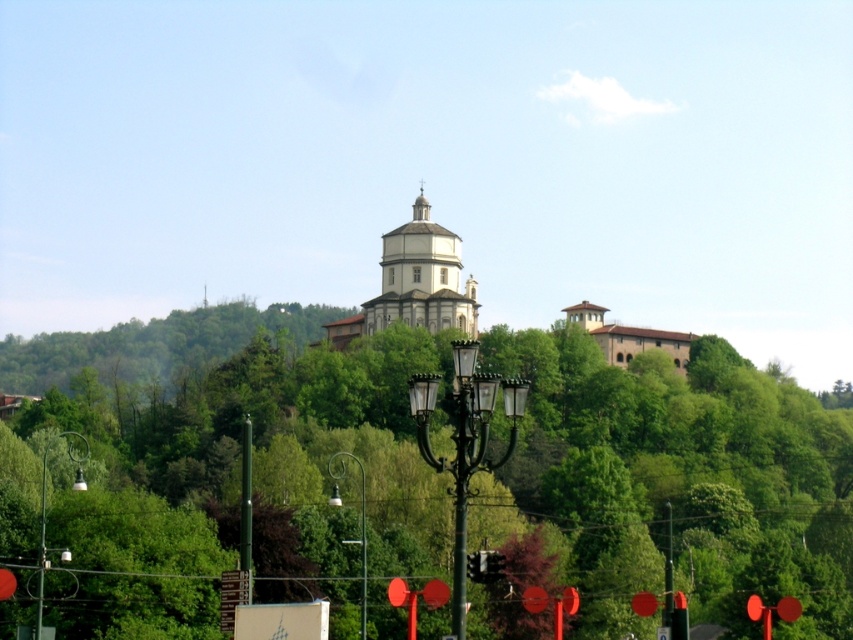
Question: Which object is closer to the camera taking this photo?

Choices:
 (A) brown stone building at upper right
 (B) white smooth church at center
 (C) green leafy tree at upper center

Answer: (C)

Question: Does green leafy tree at upper center appear on the right side of metallic black streetlight at lower left?

Choices:
 (A) no
 (B) yes

Answer: (B)

Question: Which point appears closest to the camera in this image?

Choices:
 (A) (415, 310)
 (B) (119, 400)
 (C) (74, 490)

Answer: (C)

Question: Which object is the closest to the metallic black streetlight at lower left?

Choices:
 (A) white smooth church at center
 (B) metallic glass lamp post at center

Answer: (B)

Question: Does white smooth church at center have a smaller size compared to metallic black streetlight at lower left?

Choices:
 (A) no
 (B) yes

Answer: (B)

Question: Can you confirm if brown stone building at upper right is wider than metallic glass lamp post at center?

Choices:
 (A) yes
 (B) no

Answer: (A)